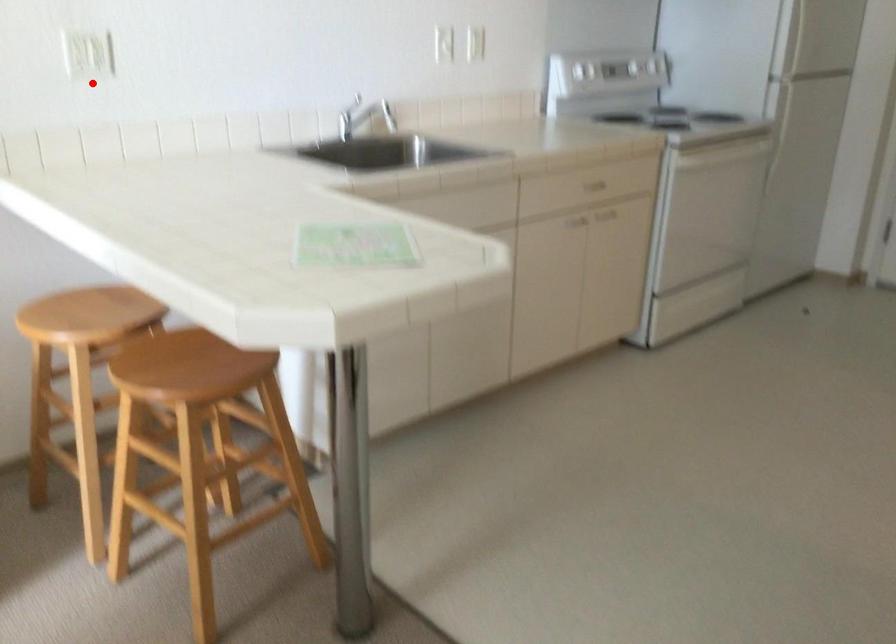
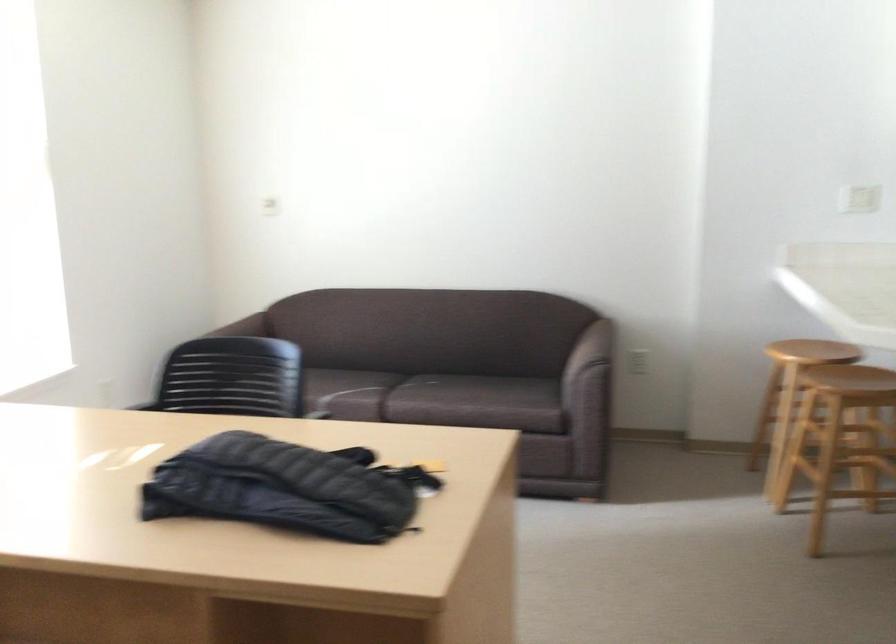
Locate, in the second image, the point that corresponds to the highlighted location in the first image.

(858, 198)